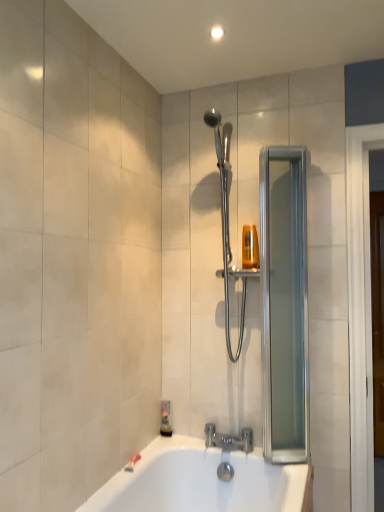
Question: From a real-world perspective, does polished chrome shower at center stand above clear glass screen door at right?

Choices:
 (A) yes
 (B) no

Answer: (A)

Question: Is polished chrome shower at center surrounding clear glass screen door at right?

Choices:
 (A) no
 (B) yes

Answer: (A)

Question: From the image's perspective, is polished chrome shower at center located above clear glass screen door at right?

Choices:
 (A) yes
 (B) no

Answer: (A)

Question: Considering the relative sizes of polished chrome shower at center and clear glass screen door at right in the image provided, is polished chrome shower at center taller than clear glass screen door at right?

Choices:
 (A) no
 (B) yes

Answer: (A)

Question: Are polished chrome shower at center and clear glass screen door at right far apart?

Choices:
 (A) no
 (B) yes

Answer: (A)

Question: Does polished chrome shower at center appear on the right side of clear glass screen door at right?

Choices:
 (A) yes
 (B) no

Answer: (B)

Question: Is silver metallic faucet at lower center oriented towards polished chrome shower at center?

Choices:
 (A) no
 (B) yes

Answer: (A)

Question: Is silver metallic faucet at lower center not close to polished chrome shower at center?

Choices:
 (A) yes
 (B) no

Answer: (B)

Question: Considering the relative sizes of silver metallic faucet at lower center and polished chrome shower at center in the image provided, is silver metallic faucet at lower center thinner than polished chrome shower at center?

Choices:
 (A) yes
 (B) no

Answer: (A)

Question: From the image's perspective, is silver metallic faucet at lower center under polished chrome shower at center?

Choices:
 (A) yes
 (B) no

Answer: (A)

Question: Is silver metallic faucet at lower center positioned behind polished chrome shower at center?

Choices:
 (A) yes
 (B) no

Answer: (A)

Question: Is silver metallic faucet at lower center surrounding polished chrome shower at center?

Choices:
 (A) no
 (B) yes

Answer: (A)

Question: From the image's perspective, is polished chrome shower at center on top of silver metallic faucet at lower center?

Choices:
 (A) yes
 (B) no

Answer: (A)